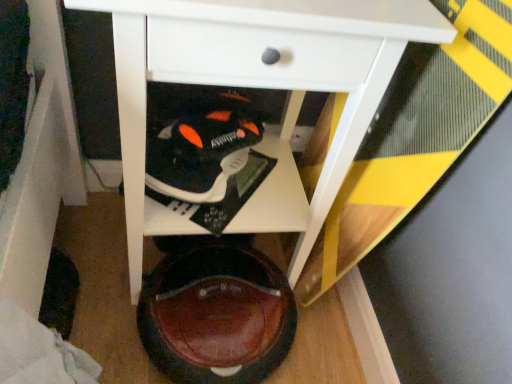
The image size is (512, 384). What do you see at coordinates (255, 87) in the screenshot?
I see `white glossy table at center` at bounding box center [255, 87].

Find the location of a particular element. This screenshot has height=384, width=512. white glossy table at center is located at coordinates (255, 87).

Identify the location of brown leather shoe at lower center, arranged as the 1th footwear when ordered from the bottom. (217, 315).

What is the approximate width of brown leather shoe at lower center, arranged as the 1th footwear when ordered from the bottom?

brown leather shoe at lower center, arranged as the 1th footwear when ordered from the bottom, is 33.91 centimeters in width.

Where is `black matte sneaker at center, positioned as the 1th footwear in top-to-bottom order`? This screenshot has height=384, width=512. black matte sneaker at center, positioned as the 1th footwear in top-to-bottom order is located at coordinates (203, 151).

Are black matte sneaker at center, arranged as the 2th footwear when ordered from the bottom, and white glossy table at center located far from each other?

black matte sneaker at center, arranged as the 2th footwear when ordered from the bottom, is near white glossy table at center, not far away.

Is black matte sneaker at center, arranged as the 2th footwear when ordered from the bottom, oriented towards white glossy table at center?

Yes, black matte sneaker at center, arranged as the 2th footwear when ordered from the bottom, faces towards white glossy table at center.

Is black matte sneaker at center, arranged as the 2th footwear when ordered from the bottom, located outside white glossy table at center?

Actually, black matte sneaker at center, arranged as the 2th footwear when ordered from the bottom, is at least partially inside white glossy table at center.

Considering the points (162, 159) and (159, 214), which point is behind, point (162, 159) or point (159, 214)?

The point (159, 214) is farther.

In the image, is white glossy table at center on the left side or the right side of black matte sneaker at center, arranged as the 2th footwear when ordered from the bottom?

Based on their positions, white glossy table at center is located to the right of black matte sneaker at center, arranged as the 2th footwear when ordered from the bottom.

Is white glossy table at center touching black matte sneaker at center, arranged as the 2th footwear when ordered from the bottom?

They are not placed beside each other.

Can you confirm if white glossy table at center is wider than black matte sneaker at center, positioned as the 1th footwear in top-to-bottom order?

Yes, white glossy table at center is wider than black matte sneaker at center, positioned as the 1th footwear in top-to-bottom order.

Which of these two, white glossy table at center or brown leather shoe at lower center, arranged as the 1th footwear when ordered from the bottom, stands taller?

white glossy table at center.

Is white glossy table at center wider than brown leather shoe at lower center, arranged as the 1th footwear when ordered from the bottom?

Yes.

How distant is white glossy table at center from brown leather shoe at lower center, arranged as the 1th footwear when ordered from the bottom?

9.27 inches.

Is white glossy table at center bigger than brown leather shoe at lower center, which is counted as the second footwear, starting from the top?

Yes.

Is black matte sneaker at center, positioned as the 1th footwear in top-to-bottom order, placed right next to brown leather shoe at lower center, which is counted as the second footwear, starting from the top?

No, black matte sneaker at center, positioned as the 1th footwear in top-to-bottom order, is not touching brown leather shoe at lower center, which is counted as the second footwear, starting from the top.

Identify the location of footwear behind the brown leather shoe at lower center, which is counted as the second footwear, starting from the top. (203, 151).

Is black matte sneaker at center, positioned as the 1th footwear in top-to-bottom order, thinner than brown leather shoe at lower center, which is counted as the second footwear, starting from the top?

Indeed, black matte sneaker at center, positioned as the 1th footwear in top-to-bottom order, has a lesser width compared to brown leather shoe at lower center, which is counted as the second footwear, starting from the top.

From a real-world perspective, does black matte sneaker at center, arranged as the 2th footwear when ordered from the bottom, stand above brown leather shoe at lower center, which is counted as the second footwear, starting from the top?

Correct, in the physical world, black matte sneaker at center, arranged as the 2th footwear when ordered from the bottom, is higher than brown leather shoe at lower center, which is counted as the second footwear, starting from the top.

Can you see brown leather shoe at lower center, arranged as the 1th footwear when ordered from the bottom, touching white glossy table at center?

There is a gap between brown leather shoe at lower center, arranged as the 1th footwear when ordered from the bottom, and white glossy table at center.

Could you tell me if brown leather shoe at lower center, arranged as the 1th footwear when ordered from the bottom, is turned towards white glossy table at center?

No, brown leather shoe at lower center, arranged as the 1th footwear when ordered from the bottom, is not turned towards white glossy table at center.

Is point (284, 338) less distant than point (270, 141)?

Yes.

In the image, is brown leather shoe at lower center, arranged as the 1th footwear when ordered from the bottom, positioned in front of or behind white glossy table at center?

In the image, brown leather shoe at lower center, arranged as the 1th footwear when ordered from the bottom, appears behind white glossy table at center.

Is brown leather shoe at lower center, which is counted as the second footwear, starting from the top, not inside black matte sneaker at center, positioned as the 1th footwear in top-to-bottom order?

brown leather shoe at lower center, which is counted as the second footwear, starting from the top, lies outside black matte sneaker at center, positioned as the 1th footwear in top-to-bottom order,'s area.

Between point (193, 356) and point (236, 119), which one is positioned behind?

The point (236, 119) is farther.

Who is bigger, brown leather shoe at lower center, arranged as the 1th footwear when ordered from the bottom, or black matte sneaker at center, positioned as the 1th footwear in top-to-bottom order?

brown leather shoe at lower center, arranged as the 1th footwear when ordered from the bottom, is bigger.

From the image's perspective, is brown leather shoe at lower center, arranged as the 1th footwear when ordered from the bottom, above black matte sneaker at center, positioned as the 1th footwear in top-to-bottom order?

No, from the image's perspective, brown leather shoe at lower center, arranged as the 1th footwear when ordered from the bottom, is not over black matte sneaker at center, positioned as the 1th footwear in top-to-bottom order.

The height and width of the screenshot is (384, 512). Identify the location of table above the black matte sneaker at center, arranged as the 2th footwear when ordered from the bottom (from a real-world perspective). (255, 87).

From the image's perspective, count 1st footwears downward from the white glossy table at center and point to it. Please provide its 2D coordinates.

[(203, 151)]

Which object lies nearer to the anchor point white glossy table at center, black matte sneaker at center, positioned as the 1th footwear in top-to-bottom order, or brown leather shoe at lower center, which is counted as the second footwear, starting from the top?

black matte sneaker at center, positioned as the 1th footwear in top-to-bottom order.

From the image, which object appears to be farther from black matte sneaker at center, arranged as the 2th footwear when ordered from the bottom, brown leather shoe at lower center, which is counted as the second footwear, starting from the top, or white glossy table at center?

brown leather shoe at lower center, which is counted as the second footwear, starting from the top, is positioned further to the anchor black matte sneaker at center, arranged as the 2th footwear when ordered from the bottom.

Estimate the real-world distances between objects in this image. Which object is further from brown leather shoe at lower center, which is counted as the second footwear, starting from the top, black matte sneaker at center, positioned as the 1th footwear in top-to-bottom order, or white glossy table at center?

black matte sneaker at center, positioned as the 1th footwear in top-to-bottom order, lies further to brown leather shoe at lower center, which is counted as the second footwear, starting from the top, than the other object.

Based on their spatial positions, is white glossy table at center or black matte sneaker at center, positioned as the 1th footwear in top-to-bottom order, further from brown leather shoe at lower center, which is counted as the second footwear, starting from the top?

black matte sneaker at center, positioned as the 1th footwear in top-to-bottom order, is further to brown leather shoe at lower center, which is counted as the second footwear, starting from the top.

From the image, which object appears to be farther from white glossy table at center, brown leather shoe at lower center, arranged as the 1th footwear when ordered from the bottom, or black matte sneaker at center, arranged as the 2th footwear when ordered from the bottom?

Among the two, brown leather shoe at lower center, arranged as the 1th footwear when ordered from the bottom, is located further to white glossy table at center.

Considering their positions, is white glossy table at center positioned further to black matte sneaker at center, positioned as the 1th footwear in top-to-bottom order, than brown leather shoe at lower center, which is counted as the second footwear, starting from the top?

brown leather shoe at lower center, which is counted as the second footwear, starting from the top.

You are a GUI agent. You are given a task and a screenshot of the screen. Output one action in this format:
    pyautogui.click(x=<x>, y=<y>)
    Task: Click on the footwear located between white glossy table at center and black matte sneaker at center, arranged as the 2th footwear when ordered from the bottom, in the depth direction
    
    Given the screenshot: What is the action you would take?
    [217, 315]